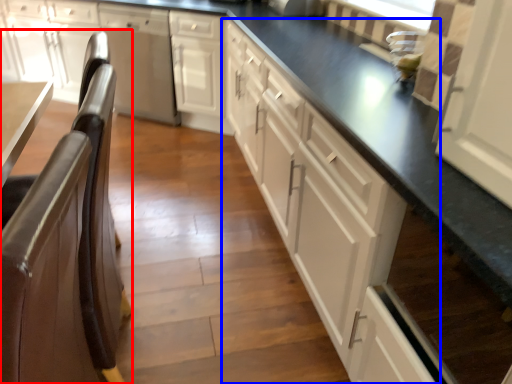
Question: Which object is closer to the camera taking this photo, chair (highlighted by a red box) or cabinetry (highlighted by a blue box)?

Choices:
 (A) chair
 (B) cabinetry

Answer: (B)